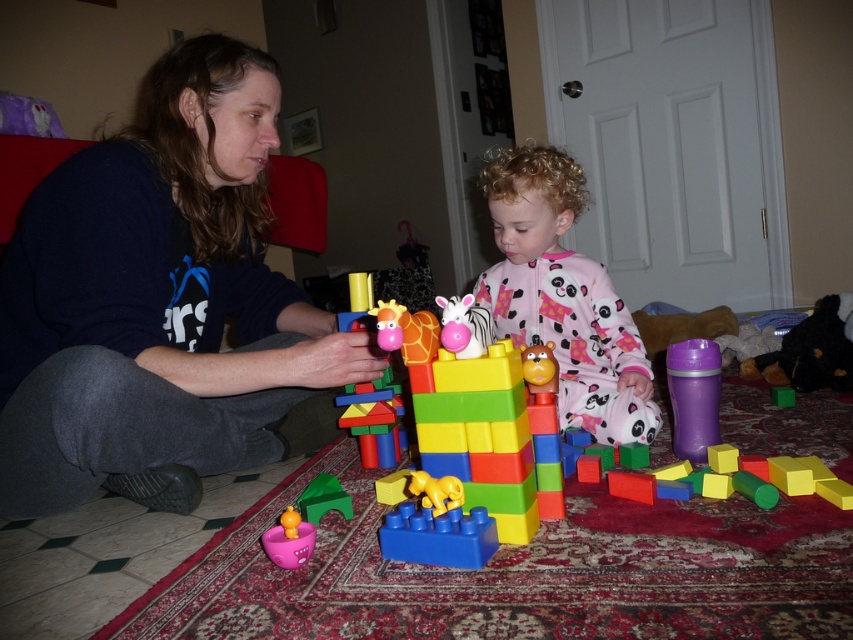
Is rubberized plastic building blocks at center below green plastic boat at lower center?

Incorrect, rubberized plastic building blocks at center is not positioned below green plastic boat at lower center.

Is point (662, 522) positioned before point (347, 493)?

Yes, point (662, 522) is closer to viewer.

Where is `rubberized plastic building blocks at center`? The image size is (853, 640). rubberized plastic building blocks at center is located at coordinates (706, 516).

This screenshot has width=853, height=640. Identify the location of rubberized plastic building blocks at center. (706, 516).

Between matte black sweater at left and pink fleece pajamas at center, which one appears on the right side from the viewer's perspective?

From the viewer's perspective, pink fleece pajamas at center appears more on the right side.

Can you confirm if matte black sweater at left is smaller than pink fleece pajamas at center?

No, matte black sweater at left is not smaller than pink fleece pajamas at center.

You are a GUI agent. You are given a task and a screenshot of the screen. Output one action in this format:
    pyautogui.click(x=<x>, y=<y>)
    Task: Click on the matte black sweater at left
    Image resolution: width=853 pixels, height=640 pixels.
    Given the screenshot: What is the action you would take?
    pyautogui.click(x=161, y=304)

Is matte black sweater at left thinner than matte plastic boat at lower left?

In fact, matte black sweater at left might be wider than matte plastic boat at lower left.

In the scene shown: Is matte black sweater at left smaller than matte plastic boat at lower left?

No, matte black sweater at left is not smaller than matte plastic boat at lower left.

Does point (219, 454) come behind point (292, 566)?

Yes, point (219, 454) is behind point (292, 566).

Locate an element on the screen. The width and height of the screenshot is (853, 640). matte black sweater at left is located at coordinates tap(161, 304).